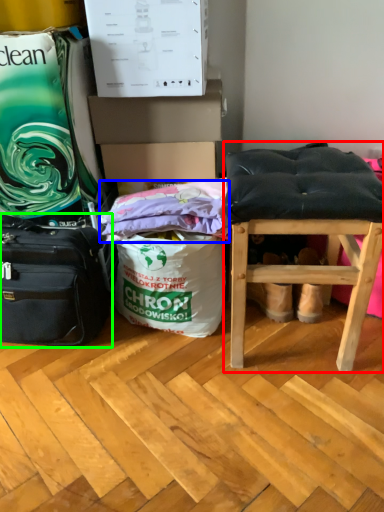
Question: Which object is positioned farthest from stool (highlighted by a red box)? Select from material (highlighted by a blue box) and luggage and bags (highlighted by a green box).

Choices:
 (A) material
 (B) luggage and bags

Answer: (B)